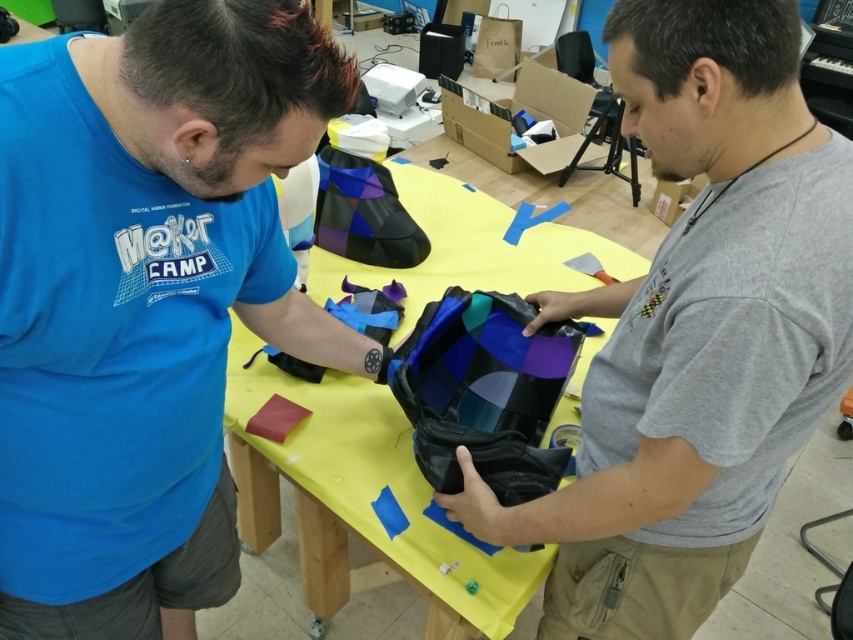
Question: Is matte blue shirt at left to the left of matte black bag at center from the viewer's perspective?

Choices:
 (A) yes
 (B) no

Answer: (A)

Question: Which object is positioned farthest from the matte black bag at center?

Choices:
 (A) yellow fabric table at center
 (B) matte blue shirt at left

Answer: (B)

Question: Does matte blue shirt at left have a lesser width compared to yellow fabric table at center?

Choices:
 (A) no
 (B) yes

Answer: (B)

Question: Among these points, which one is farthest from the camera?

Choices:
 (A) (744, 163)
 (B) (96, 250)
 (C) (538, 577)

Answer: (C)

Question: Does matte blue shirt at left appear over matte black bag at center?

Choices:
 (A) no
 (B) yes

Answer: (A)

Question: Among these points, which one is nearest to the camera?

Choices:
 (A) (590, 296)
 (B) (15, 502)

Answer: (B)